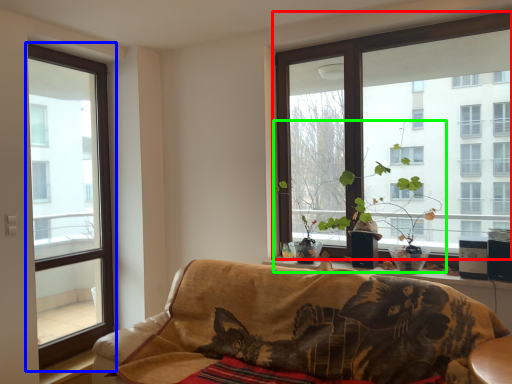
Question: Based on their relative distances, which object is nearer to window (highlighted by a red box)? Choose from window (highlighted by a blue box) and houseplant (highlighted by a green box).

Choices:
 (A) window
 (B) houseplant

Answer: (B)